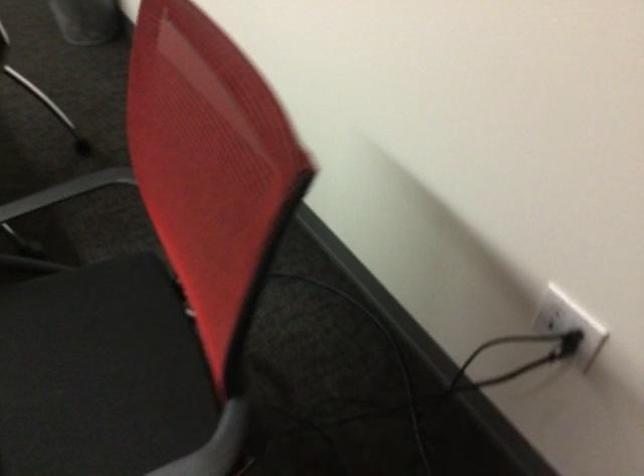
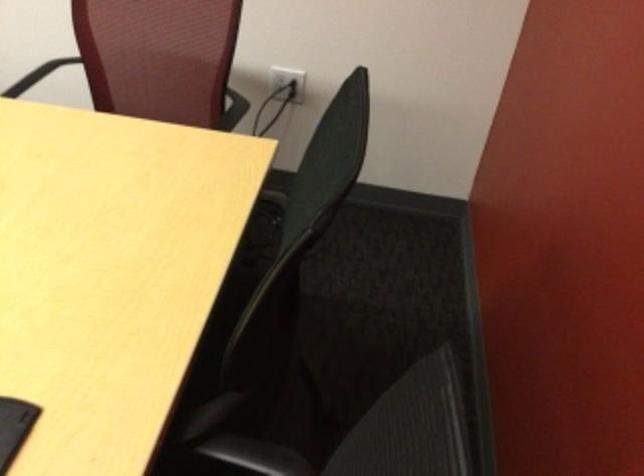
Question: I am providing you with two images of the same scene from different viewpoints. After the viewpoint changes to image2, which objects are now occluded?

Choices:
 (A) chair sitting surface
 (B) black electrical plug
 (C) white grocery bag
 (D) black chair armrest

Answer: (A)